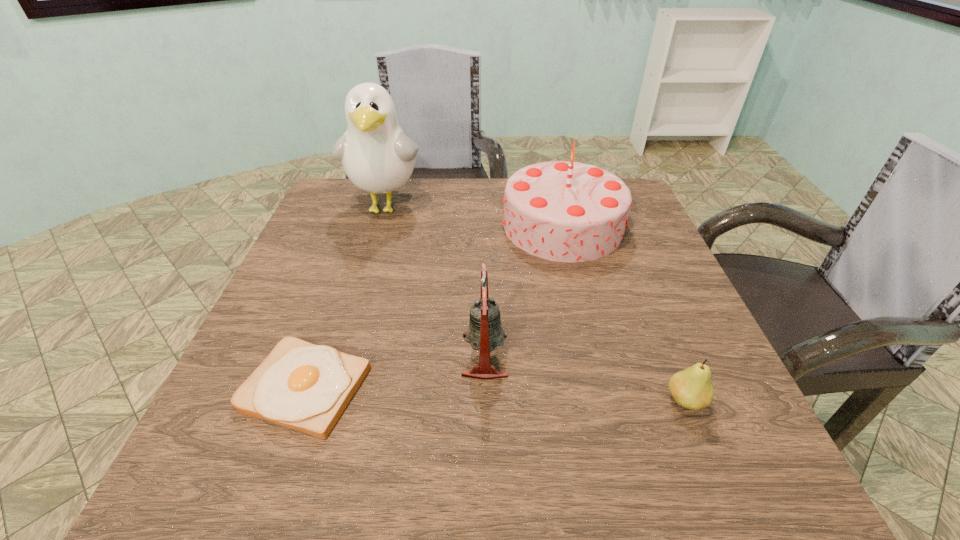
Identify the location of object situated at the far right corner. This screenshot has width=960, height=540. (566, 211).

The height and width of the screenshot is (540, 960). What are the coordinates of `free space at the far edge` in the screenshot? It's located at (481, 204).

You are a GUI agent. You are given a task and a screenshot of the screen. Output one action in this format:
    pyautogui.click(x=<x>, y=<y>)
    Task: Click on the blank area at the near edge
    This screenshot has width=960, height=540.
    Given the screenshot: What is the action you would take?
    pyautogui.click(x=551, y=453)

Locate an element on the screen. free space at the right edge of the desktop is located at coordinates (630, 239).

Find the location of a particular element. vacant region at the far left corner of the desktop is located at coordinates (364, 221).

In the image, there is a desktop. What are the coordinates of `vacant region at the far right corner` in the screenshot? It's located at (626, 185).

Where is `vacant space at the near right corner`? vacant space at the near right corner is located at coordinates tap(760, 454).

This screenshot has height=540, width=960. I want to click on empty location between the birthday cake and the bell, so click(x=524, y=291).

At what (x,y) coordinates should I click in order to perform the action: click on vacant area between the tallest object and the toast. Please return your answer as a coordinate pair (x, y). Looking at the image, I should click on (346, 297).

You are a GUI agent. You are given a task and a screenshot of the screen. Output one action in this format:
    pyautogui.click(x=<x>, y=<y>)
    Task: Click on the free spot between the third object from right to left and the shortest object
    The image size is (960, 540).
    Given the screenshot: What is the action you would take?
    pyautogui.click(x=396, y=371)